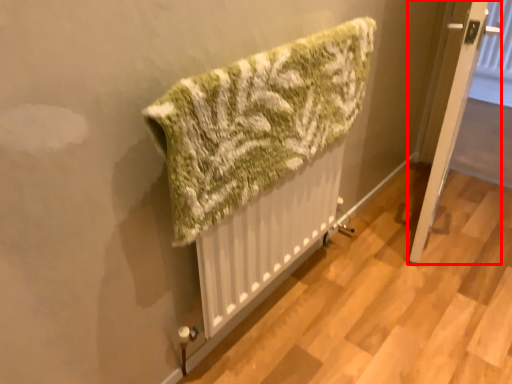
Question: From the image's perspective, what is the correct spatial positioning of door (annotated by the red box) in reference to towel?

Choices:
 (A) above
 (B) below

Answer: (A)